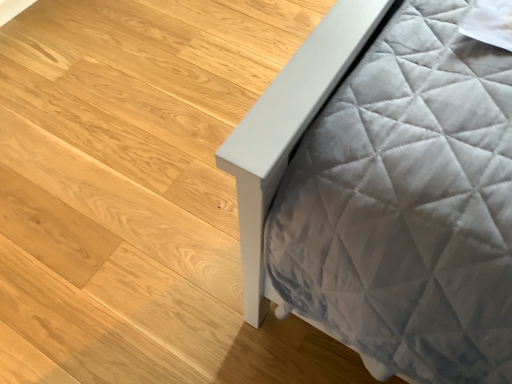
Consider the image. Measure the distance between point (362, 357) and camera.

Point (362, 357) and camera are 22.17 inches apart from each other.

I want to click on gray quilted bed at upper right, so click(x=386, y=190).

Describe the element at coordinates (386, 190) in the screenshot. I see `gray quilted bed at upper right` at that location.

Locate an element on the screen. The height and width of the screenshot is (384, 512). gray quilted bed at upper right is located at coordinates (386, 190).